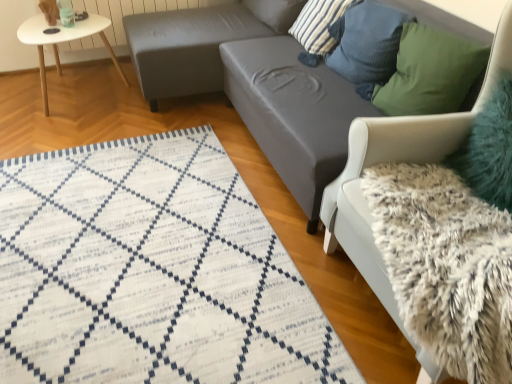
In order to face white glossy table at upper left, should I rotate leftwards or rightwards?

Turn left by 22.624 degrees to look at white glossy table at upper left.

I want to click on teal glass at upper left, so click(66, 13).

Consider the image. Considering the relative sizes of gray fabric footrest at center and striped fabric pillow at upper center, which ranks as the fifth pillow in front-to-back order, in the image provided, is gray fabric footrest at center wider than striped fabric pillow at upper center, which ranks as the fifth pillow in front-to-back order,?

Indeed, gray fabric footrest at center has a greater width compared to striped fabric pillow at upper center, which ranks as the fifth pillow in front-to-back order.

Is gray fabric footrest at center not close to striped fabric pillow at upper center, which is the 1th pillow from back to front?

That's not correct — gray fabric footrest at center is a little close to striped fabric pillow at upper center, which is the 1th pillow from back to front.

Which is more to the left, gray fabric footrest at center or striped fabric pillow at upper center, which is the 1th pillow from back to front?

From the viewer's perspective, gray fabric footrest at center appears more on the left side.

Could you measure the distance between gray fabric footrest at center and striped fabric pillow at upper center, which is the 1th pillow from back to front?

A distance of 16.72 inches exists between gray fabric footrest at center and striped fabric pillow at upper center, which is the 1th pillow from back to front.

Which is in front, blue textured pillow at upper right, marked as the third pillow in a back-to-front arrangement, or teal glass at upper left?

Positioned in front is blue textured pillow at upper right, marked as the third pillow in a back-to-front arrangement.

From a real-world perspective, is blue textured pillow at upper right, marked as the third pillow in a back-to-front arrangement, under teal glass at upper left?

No, from a real-world perspective, blue textured pillow at upper right, marked as the third pillow in a back-to-front arrangement, is not beneath teal glass at upper left.

Does blue textured pillow at upper right, which is counted as the third pillow, starting from the front, have a smaller size compared to teal glass at upper left?

Actually, blue textured pillow at upper right, which is counted as the third pillow, starting from the front, might be larger than teal glass at upper left.

Considering the sizes of blue textured pillow at upper right, which is counted as the third pillow, starting from the front, and teal glass at upper left in the image, is blue textured pillow at upper right, which is counted as the third pillow, starting from the front, wider or thinner than teal glass at upper left?

Clearly, blue textured pillow at upper right, which is counted as the third pillow, starting from the front, has more width compared to teal glass at upper left.

Does white fluffy swivel chair at right have a greater width compared to blue textured pillow at upper right, which is counted as the third pillow, starting from the front?

Yes.

Is white fluffy swivel chair at right positioned beyond the bounds of blue textured pillow at upper right, which is counted as the third pillow, starting from the front?

Indeed, white fluffy swivel chair at right is completely outside blue textured pillow at upper right, which is counted as the third pillow, starting from the front.

Is white fluffy swivel chair at right further to camera compared to blue textured pillow at upper right, which is counted as the third pillow, starting from the front?

Result: No, white fluffy swivel chair at right is closer to the camera.

Is white fluffy swivel chair at right oriented towards blue textured pillow at upper right, which is counted as the third pillow, starting from the front?

No.

Where is `swivel chair on the right side of striped fabric pillow at upper center, which ranks as the fifth pillow in front-to-back order`? This screenshot has height=384, width=512. swivel chair on the right side of striped fabric pillow at upper center, which ranks as the fifth pillow in front-to-back order is located at coordinates (399, 161).

Does striped fabric pillow at upper center, which is the 1th pillow from back to front, come behind white fluffy swivel chair at right?

Yes, striped fabric pillow at upper center, which is the 1th pillow from back to front, is further from the viewer.

Considering the positions of objects striped fabric pillow at upper center, which ranks as the fifth pillow in front-to-back order, and white fluffy swivel chair at right in the image provided, who is more to the right, striped fabric pillow at upper center, which ranks as the fifth pillow in front-to-back order, or white fluffy swivel chair at right?

white fluffy swivel chair at right.

From the image's perspective, who appears lower, striped fabric pillow at upper center, which is the 1th pillow from back to front, or white fluffy swivel chair at right?

white fluffy swivel chair at right, from the image's perspective.

Considering the sizes of objects gray fabric footrest at center and white glossy table at upper left in the image provided, who is taller, gray fabric footrest at center or white glossy table at upper left?

With more height is gray fabric footrest at center.

From a real-world perspective, is gray fabric footrest at center positioned over white glossy table at upper left based on gravity?

Indeed, from a real-world perspective, gray fabric footrest at center stands above white glossy table at upper left.

Which is correct: gray fabric footrest at center is inside white glossy table at upper left, or outside of it?

The correct answer is: outside.

Relative to blue textured pillow at upper right, which is counted as the third pillow, starting from the front, is teal fuzzy pillow at upper right, marked as the first pillow in a front-to-back arrangement, in front or behind?

In the image, teal fuzzy pillow at upper right, marked as the first pillow in a front-to-back arrangement, appears in front of blue textured pillow at upper right, which is counted as the third pillow, starting from the front.

Consider the image. Is teal fuzzy pillow at upper right, the fifth pillow when ordered from back to front, situated inside blue textured pillow at upper right, marked as the third pillow in a back-to-front arrangement, or outside?

teal fuzzy pillow at upper right, the fifth pillow when ordered from back to front, exists outside the volume of blue textured pillow at upper right, marked as the third pillow in a back-to-front arrangement.

From the image's perspective, is teal fuzzy pillow at upper right, marked as the first pillow in a front-to-back arrangement, over blue textured pillow at upper right, which is counted as the third pillow, starting from the front?

No.

Is white fluffy swivel chair at right not near teal fuzzy pillow at upper right, the fifth pillow when ordered from back to front?

No, there isn't a large distance between white fluffy swivel chair at right and teal fuzzy pillow at upper right, the fifth pillow when ordered from back to front.

Which of these two, white fluffy swivel chair at right or teal fuzzy pillow at upper right, the fifth pillow when ordered from back to front, is wider?

With larger width is white fluffy swivel chair at right.

Between point (436, 149) and point (502, 103), which one is positioned behind?

The point (436, 149) is farther from the camera.

Do you think white fluffy swivel chair at right is within teal fuzzy pillow at upper right, marked as the first pillow in a front-to-back arrangement, or outside of it?

white fluffy swivel chair at right is not enclosed by teal fuzzy pillow at upper right, marked as the first pillow in a front-to-back arrangement.

I want to click on pillow above the gray fabric footrest at center (from the image's perspective), so click(276, 12).

I want to click on the 3rd pillow to the right when counting from the teal glass at upper left, so click(367, 42).

Based on their spatial positions, is gray fabric couch at center or white fluffy swivel chair at right further from white glossy table at upper left?

The object further to white glossy table at upper left is white fluffy swivel chair at right.

Considering their positions, is green fabric pillow at upper right, which is the 2th pillow from front to back, positioned further to striped fabric pillow at upper center, which ranks as the fifth pillow in front-to-back order, than white fluffy swivel chair at right?

white fluffy swivel chair at right is positioned further to the anchor striped fabric pillow at upper center, which ranks as the fifth pillow in front-to-back order.

Looking at the image, which one is located closer to gray fabric footrest at center, blue textured pillow at upper right, which is counted as the third pillow, starting from the front, or striped fabric pillow at upper right, acting as the fourth pillow starting from the front?

Among the two, striped fabric pillow at upper right, acting as the fourth pillow starting from the front, is located nearer to gray fabric footrest at center.

From the image, which object appears to be farther from teal fuzzy pillow at upper right, marked as the first pillow in a front-to-back arrangement, white woven mat at lower left or striped fabric pillow at upper center, which is the 1th pillow from back to front?

Based on the image, striped fabric pillow at upper center, which is the 1th pillow from back to front, appears to be further to teal fuzzy pillow at upper right, marked as the first pillow in a front-to-back arrangement.

Which object lies further to the anchor point striped fabric pillow at upper right, the 2th pillow when ordered from back to front, striped fabric pillow at upper center, which is the 1th pillow from back to front, or gray fabric couch at center?

gray fabric couch at center is further to striped fabric pillow at upper right, the 2th pillow when ordered from back to front.

When comparing their distances from gray fabric couch at center, does green fabric pillow at upper right, which is the 4th pillow in back-to-front order, or teal glass at upper left seem closer?

green fabric pillow at upper right, which is the 4th pillow in back-to-front order, lies closer to gray fabric couch at center than the other object.

Based on their spatial positions, is white glossy table at upper left or blue textured pillow at upper right, which is counted as the third pillow, starting from the front, closer to teal glass at upper left?

white glossy table at upper left lies closer to teal glass at upper left than the other object.

When comparing their distances from teal fuzzy pillow at upper right, the fifth pillow when ordered from back to front, does striped fabric pillow at upper center, which ranks as the fifth pillow in front-to-back order, or teal glass at upper left seem further?

The object further to teal fuzzy pillow at upper right, the fifth pillow when ordered from back to front, is teal glass at upper left.

This screenshot has width=512, height=384. I want to click on footrest between green fabric pillow at upper right, which is the 4th pillow in back-to-front order, and striped fabric pillow at upper center, which is the 1th pillow from back to front, along the z-axis, so click(x=186, y=47).

Identify the location of couch between white woven mat at lower left and teal fuzzy pillow at upper right, the fifth pillow when ordered from back to front. (293, 113).

You are a GUI agent. You are given a task and a screenshot of the screen. Output one action in this format:
    pyautogui.click(x=<x>, y=<y>)
    Task: Click on the footrest between white glossy table at upper left and striped fabric pillow at upper right, the 2th pillow when ordered from back to front
    The image size is (512, 384).
    Given the screenshot: What is the action you would take?
    pyautogui.click(x=186, y=47)

At what (x,y) coordinates should I click in order to perform the action: click on pillow between green fabric pillow at upper right, which is the 2th pillow from front to back, and striped fabric pillow at upper right, acting as the fourth pillow starting from the front, along the z-axis. Please return your answer as a coordinate pair (x, y). The height and width of the screenshot is (384, 512). Looking at the image, I should click on (367, 42).